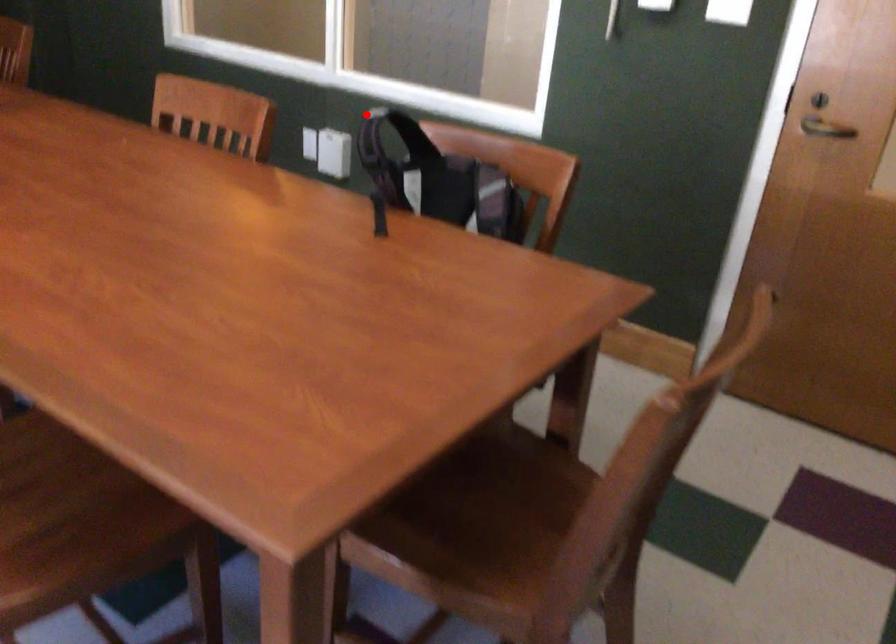
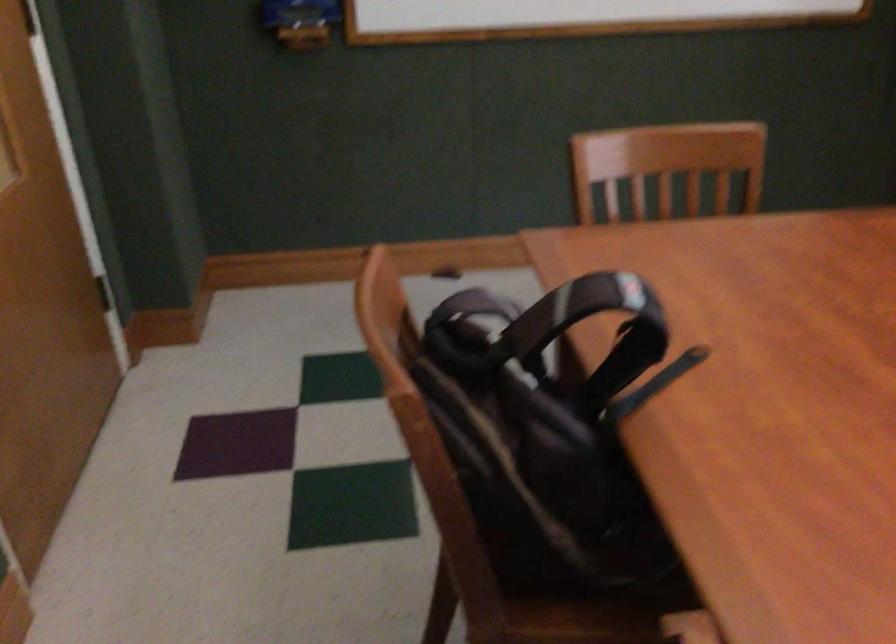
Question: A red point is marked in image1. In image2, is the corresponding 3D point closer to the camera or farther? Reply with the corresponding letter.

Choices:
 (A) The corresponding 3D point is closer.
 (B) The corresponding 3D point is farther.

Answer: (A)